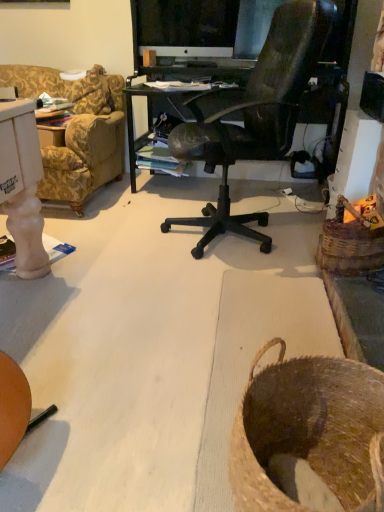
Question: From a real-world perspective, relative to white glossy computer monitor at upper center, is brown woven basket at lower right, the second basket from the back, vertically above or below?

Choices:
 (A) above
 (B) below

Answer: (B)

Question: Considering the relative positions of brown woven basket at lower right, the 2th basket in the right-to-left sequence, and white glossy computer monitor at upper center in the image provided, is brown woven basket at lower right, the 2th basket in the right-to-left sequence, to the left or to the right of white glossy computer monitor at upper center?

Choices:
 (A) left
 (B) right

Answer: (B)

Question: Considering the real-world distances, which object is closest to the woven brown basket at right, which appears as the 2th basket when viewed from the front?

Choices:
 (A) brown woven basket at lower right, acting as the 1th basket starting from the front
 (B) white glossy computer monitor at upper center

Answer: (A)

Question: Which object is positioned closest to the brown woven basket at lower right, which is the 1th basket in left-to-right order?

Choices:
 (A) woven brown basket at right, the first basket viewed from the back
 (B) white glossy computer monitor at upper center

Answer: (A)